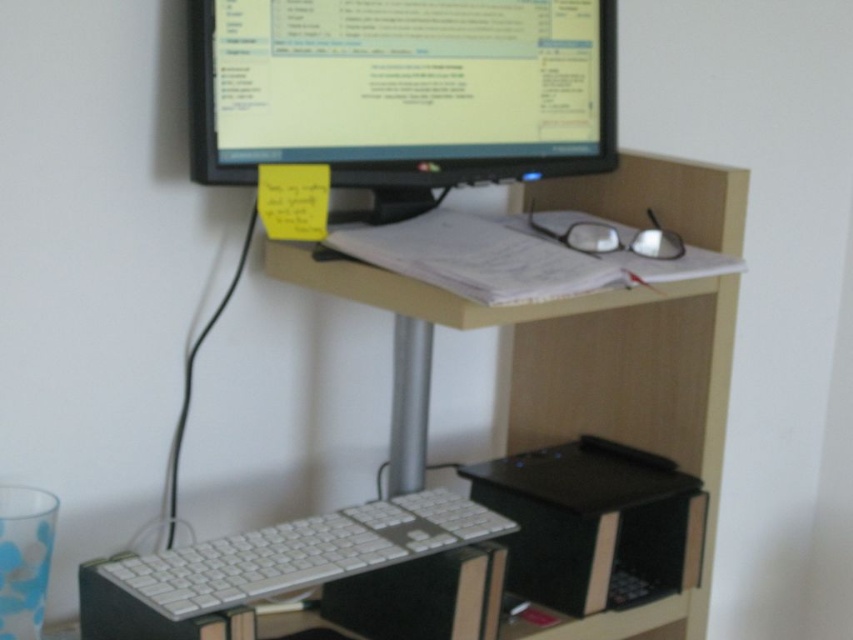
Question: Does matte black monitor at upper center come in front of white plastic keyboard at center?

Choices:
 (A) yes
 (B) no

Answer: (B)

Question: Which of these objects is positioned closest to the wooden computer desk at center?

Choices:
 (A) white plastic keyboard at center
 (B) matte black monitor at upper center

Answer: (A)

Question: Can you confirm if wooden computer desk at center is positioned to the left of matte black monitor at upper center?

Choices:
 (A) no
 (B) yes

Answer: (A)

Question: Does matte black monitor at upper center lie in front of white plastic keyboard at center?

Choices:
 (A) no
 (B) yes

Answer: (A)

Question: Which object appears closest to the camera in this image?

Choices:
 (A) wooden computer desk at center
 (B) white plastic keyboard at center

Answer: (B)

Question: Which object is farther from the camera taking this photo?

Choices:
 (A) white plastic keyboard at center
 (B) matte black monitor at upper center

Answer: (B)